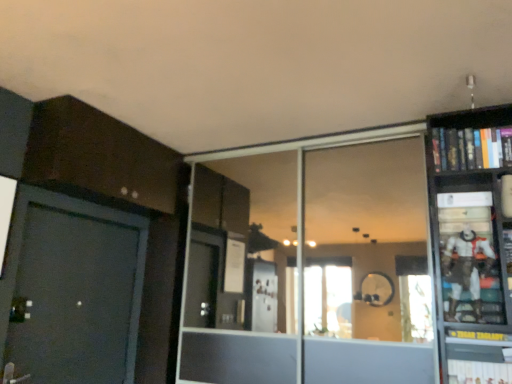
The image size is (512, 384). Describe the element at coordinates (471, 148) in the screenshot. I see `hardcover book at upper right, which is counted as the 2th book, starting from the bottom` at that location.

Identify the location of hardcover book at upper right, which is the 1th book in top-to-bottom order. The width and height of the screenshot is (512, 384). (471, 148).

What are the coordinates of `white matte action figure at right` in the screenshot? It's located at coord(466,267).

The image size is (512, 384). What do you see at coordinates (328, 270) in the screenshot? I see `transparent glass door at center` at bounding box center [328, 270].

This screenshot has width=512, height=384. What do you see at coordinates (479, 372) in the screenshot? I see `hardcover book at lower right, positioned as the 1th book in bottom-to-top order` at bounding box center [479, 372].

Locate an element on the screen. This screenshot has height=384, width=512. hardcover book at upper right, which is the 1th book in top-to-bottom order is located at coordinates (471, 148).

Which is nearer, (x=500, y=380) or (x=451, y=158)?

Clearly, point (x=500, y=380) is closer to the camera than point (x=451, y=158).

Is hardcover book at lower right, positioned as the 1th book in bottom-to-top order, taller or shorter than hardcover book at upper right, which is counted as the 2th book, starting from the bottom?

Clearly, hardcover book at lower right, positioned as the 1th book in bottom-to-top order, is shorter compared to hardcover book at upper right, which is counted as the 2th book, starting from the bottom.

From the image's perspective, would you say hardcover book at lower right, the 2th book when ordered from top to bottom, is shown under white matte action figure at right?

Yes, from the image's perspective, hardcover book at lower right, the 2th book when ordered from top to bottom, is below white matte action figure at right.

In the scene shown: How far apart are hardcover book at lower right, the 2th book when ordered from top to bottom, and white matte action figure at right?

hardcover book at lower right, the 2th book when ordered from top to bottom, is 13.72 inches from white matte action figure at right.

Does hardcover book at lower right, positioned as the 1th book in bottom-to-top order, have a larger size compared to white matte action figure at right?

Incorrect, hardcover book at lower right, positioned as the 1th book in bottom-to-top order, is not larger than white matte action figure at right.

The image size is (512, 384). I want to click on the 1st book to the right when counting from the white matte action figure at right, so click(x=479, y=372).

Who is smaller, hardcover book at upper right, which is the 1th book in top-to-bottom order, or transparent glass door at center?

With smaller size is hardcover book at upper right, which is the 1th book in top-to-bottom order.

Which object is closer to the camera, hardcover book at upper right, which is counted as the 2th book, starting from the bottom, or transparent glass door at center?

hardcover book at upper right, which is counted as the 2th book, starting from the bottom, is in front.

In the scene shown: Is hardcover book at upper right, which is counted as the 2th book, starting from the bottom, thinner than transparent glass door at center?

No.

Consider the image. Considering the relative positions of hardcover book at upper right, which is the 1th book in top-to-bottom order, and transparent glass door at center in the image provided, is hardcover book at upper right, which is the 1th book in top-to-bottom order, to the left or to the right of transparent glass door at center?

hardcover book at upper right, which is the 1th book in top-to-bottom order, is to the right of transparent glass door at center.

Is white matte action figure at right inside or outside of hardcover book at lower right, positioned as the 1th book in bottom-to-top order?

The correct answer is: outside.

Between white matte action figure at right and hardcover book at lower right, positioned as the 1th book in bottom-to-top order, which one has more height?

white matte action figure at right is taller.

Would you say white matte action figure at right is a long distance from hardcover book at lower right, the 2th book when ordered from top to bottom?

white matte action figure at right is near hardcover book at lower right, the 2th book when ordered from top to bottom, not far away.

From the image's perspective, which one is positioned higher, hardcover book at upper right, which is counted as the 2th book, starting from the bottom, or white matte action figure at right?

hardcover book at upper right, which is counted as the 2th book, starting from the bottom, is shown above in the image.

Is hardcover book at upper right, which is counted as the 2th book, starting from the bottom, outside of white matte action figure at right?

That's correct, hardcover book at upper right, which is counted as the 2th book, starting from the bottom, is outside of white matte action figure at right.

Relative to white matte action figure at right, is hardcover book at upper right, which is the 1th book in top-to-bottom order, in front or behind?

hardcover book at upper right, which is the 1th book in top-to-bottom order, is behind white matte action figure at right.

Is white matte action figure at right wider or thinner than transparent glass door at center?

Considering their sizes, white matte action figure at right looks broader than transparent glass door at center.

From a real-world perspective, relative to transparent glass door at center, is white matte action figure at right vertically above or below?

Clearly, from a real-world perspective, white matte action figure at right is below transparent glass door at center.

Considering the relative sizes of white matte action figure at right and transparent glass door at center in the image provided, is white matte action figure at right taller than transparent glass door at center?

No.

Does white matte action figure at right come in front of transparent glass door at center?

Yes, it is.

Does white matte action figure at right appear on the right side of hardcover book at upper right, which is the 1th book in top-to-bottom order?

Incorrect, white matte action figure at right is not on the right side of hardcover book at upper right, which is the 1th book in top-to-bottom order.

Locate an element on the screen. The width and height of the screenshot is (512, 384). book above the white matte action figure at right (from the image's perspective) is located at coordinates (471, 148).

From a real-world perspective, which is physically below, white matte action figure at right or hardcover book at upper right, which is the 1th book in top-to-bottom order?

white matte action figure at right is physically lower.

Is white matte action figure at right completely or partially outside of hardcover book at upper right, which is counted as the 2th book, starting from the bottom?

Yes, white matte action figure at right is not within hardcover book at upper right, which is counted as the 2th book, starting from the bottom.

There is a hardcover book at lower right, the 2th book when ordered from top to bottom. At what (x,y) coordinates should I click in order to perform the action: click on book above it (from a real-world perspective). Please return your answer as a coordinate pair (x, y). Image resolution: width=512 pixels, height=384 pixels. Looking at the image, I should click on (471, 148).

The image size is (512, 384). In order to click on book that appears in front of the white matte action figure at right in this screenshot , I will do `click(479, 372)`.

Based on their spatial positions, is white matte action figure at right or transparent glass door at center further from hardcover book at upper right, which is counted as the 2th book, starting from the bottom?

Among the two, transparent glass door at center is located further to hardcover book at upper right, which is counted as the 2th book, starting from the bottom.

From the image, which object appears to be nearer to white matte action figure at right, hardcover book at upper right, which is the 1th book in top-to-bottom order, or transparent glass door at center?

hardcover book at upper right, which is the 1th book in top-to-bottom order, is positioned closer to the anchor white matte action figure at right.

Based on their spatial positions, is white matte action figure at right or hardcover book at lower right, positioned as the 1th book in bottom-to-top order, further from transparent glass door at center?

Among the two, hardcover book at lower right, positioned as the 1th book in bottom-to-top order, is located further to transparent glass door at center.

Looking at the image, which one is located further to white matte action figure at right, hardcover book at upper right, which is the 1th book in top-to-bottom order, or hardcover book at lower right, the 2th book when ordered from top to bottom?

The object further to white matte action figure at right is hardcover book at upper right, which is the 1th book in top-to-bottom order.

Considering their positions, is white matte action figure at right positioned closer to hardcover book at lower right, positioned as the 1th book in bottom-to-top order, than transparent glass door at center?

Based on the image, white matte action figure at right appears to be nearer to hardcover book at lower right, positioned as the 1th book in bottom-to-top order.

When comparing their distances from hardcover book at upper right, which is counted as the 2th book, starting from the bottom, does hardcover book at lower right, positioned as the 1th book in bottom-to-top order, or transparent glass door at center seem further?

transparent glass door at center.

Based on the photo, based on their spatial positions, is hardcover book at lower right, the 2th book when ordered from top to bottom, or hardcover book at upper right, which is the 1th book in top-to-bottom order, closer to transparent glass door at center?

Among the two, hardcover book at upper right, which is the 1th book in top-to-bottom order, is located nearer to transparent glass door at center.

Which object lies further to the anchor point hardcover book at lower right, the 2th book when ordered from top to bottom, transparent glass door at center or hardcover book at upper right, which is the 1th book in top-to-bottom order?

Among the two, transparent glass door at center is located further to hardcover book at lower right, the 2th book when ordered from top to bottom.

This screenshot has height=384, width=512. Identify the location of toy situated between transparent glass door at center and hardcover book at lower right, positioned as the 1th book in bottom-to-top order, from left to right. (466, 267).

Where is `glass door between hardcover book at upper right, which is the 1th book in top-to-bottom order, and hardcover book at lower right, the 2th book when ordered from top to bottom, vertically`? The width and height of the screenshot is (512, 384). glass door between hardcover book at upper right, which is the 1th book in top-to-bottom order, and hardcover book at lower right, the 2th book when ordered from top to bottom, vertically is located at coordinates (328, 270).

What are the coordinates of `toy between hardcover book at upper right, which is counted as the 2th book, starting from the bottom, and hardcover book at lower right, the 2th book when ordered from top to bottom, in the up-down direction` in the screenshot? It's located at (466, 267).

Identify the location of toy between transparent glass door at center and hardcover book at upper right, which is counted as the 2th book, starting from the bottom, in the horizontal direction. (466, 267).